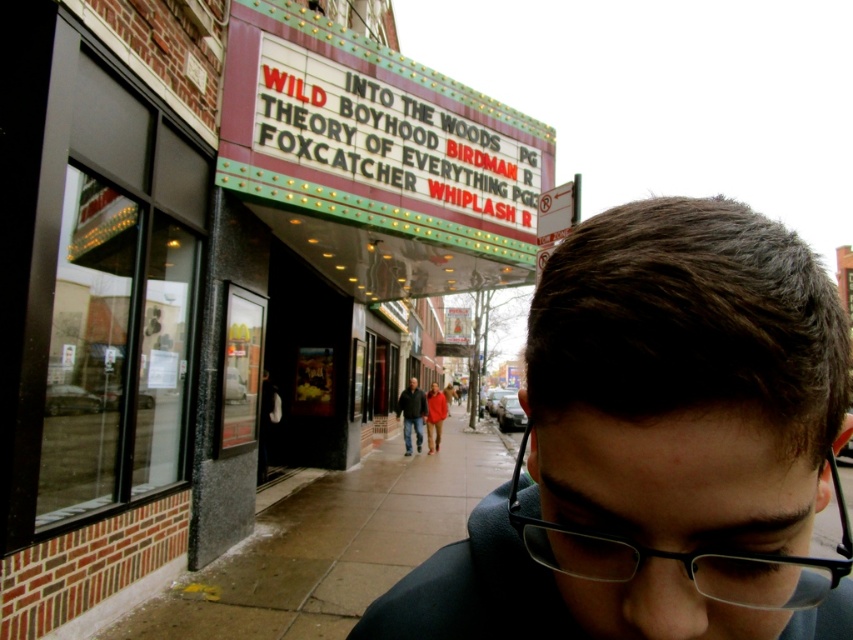
Does wet concrete sidewalk at lower center have a greater width compared to dark gray jacket at center?

Yes, wet concrete sidewalk at lower center is wider than dark gray jacket at center.

Between wet concrete sidewalk at lower center and dark gray jacket at center, which one appears on the right side from the viewer's perspective?

wet concrete sidewalk at lower center is more to the right.

Measure the distance between point (270,584) and camera.

They are 18.96 feet apart.

Where is `wet concrete sidewalk at lower center`? This screenshot has height=640, width=853. wet concrete sidewalk at lower center is located at coordinates (329, 547).

Between black plastic glasses at center and dark gray jacket at center, which one has more height?

black plastic glasses at center is taller.

The height and width of the screenshot is (640, 853). Identify the location of black plastic glasses at center. (688, 556).

At what (x,y) coordinates should I click in order to perform the action: click on black plastic glasses at center. Please return your answer as a coordinate pair (x, y). This screenshot has width=853, height=640. Looking at the image, I should click on (688, 556).

The width and height of the screenshot is (853, 640). Describe the element at coordinates (218, 268) in the screenshot. I see `brick facade at center` at that location.

Between point (48, 35) and point (641, 586), which one is positioned in front?

Point (641, 586) is more forward.

I want to click on brick facade at center, so click(x=218, y=268).